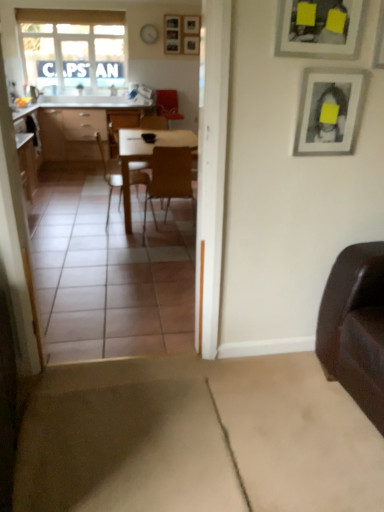
Question: Would you say matte black picture frame at upper right, the second picture frame positioned from the top, is inside or outside wooden at center, which appears as the first chair when viewed from the right?

Choices:
 (A) outside
 (B) inside

Answer: (A)

Question: In terms of height, does matte black picture frame at upper right, acting as the second picture frame starting from the right, look taller or shorter compared to wooden at center, which is the second chair in left-to-right order?

Choices:
 (A) tall
 (B) short

Answer: (B)

Question: Which object is the farthest from the wooden chair at center, which ranks as the 1th chair in left-to-right order?

Choices:
 (A) velvet red armchair at center
 (B) wooden table at center
 (C) matte silver picture frame at upper right, which is counted as the second picture frame, starting from the front
 (D) translucent fabric window at upper left
 (E) matte black picture frame at upper right, which is the second picture frame in left-to-right order

Answer: (E)

Question: Which is farther from the wooden at center, which is the second chair in left-to-right order?

Choices:
 (A) matte black picture frame at upper right, the 3th picture frame when ordered from back to front
 (B) velvet red armchair at center
 (C) wooden chair at center, which ranks as the 1th chair in left-to-right order
 (D) translucent fabric window at upper left
 (E) wooden table at center

Answer: (D)